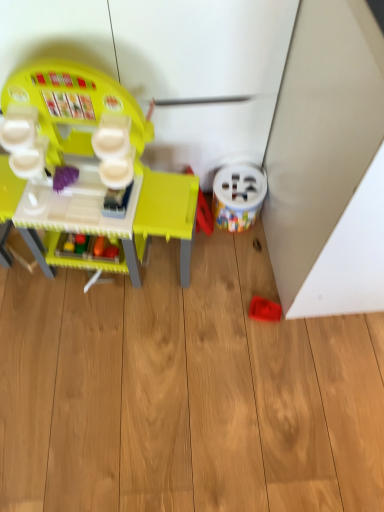
Question: In the image, is rubberized red toy at lower right, the 3th toy from the left, positioned in front of or behind matte plastic play kitchen at left, placed as the first toy when sorted from left to right?

Choices:
 (A) behind
 (B) front

Answer: (A)

Question: From a real-world perspective, is rubberized red toy at lower right, the 3th toy from the left, positioned above or below matte plastic play kitchen at left, positioned as the third toy in right-to-left order?

Choices:
 (A) below
 (B) above

Answer: (A)

Question: Which of these objects is positioned farthest from the rubberized red toy at lower right, the 3th toy from the left?

Choices:
 (A) matte plastic play kitchen at left, positioned as the third toy in right-to-left order
 (B) white plastic bucket at lower right, the second toy viewed from the right

Answer: (A)

Question: Which of these objects is positioned farthest from the rubberized red toy at lower right, which appears as the 1th toy when viewed from the right?

Choices:
 (A) white plastic bucket at lower right, the 2th toy when ordered from left to right
 (B) matte plastic play kitchen at left, placed as the first toy when sorted from left to right

Answer: (B)